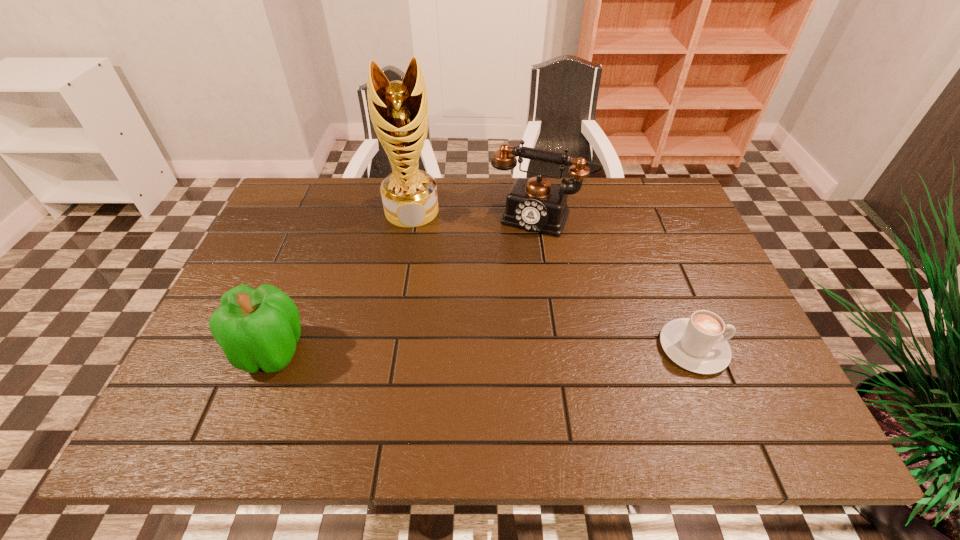
Find the location of a particular element. This screenshot has height=540, width=960. object that is positioned at the left edge is located at coordinates (257, 328).

Identify the location of object present at the right edge. (696, 344).

Where is `object positioned at the near left corner`? Image resolution: width=960 pixels, height=540 pixels. object positioned at the near left corner is located at coordinates (257, 328).

Find the location of a particular element. The width and height of the screenshot is (960, 540). object present at the near right corner is located at coordinates (696, 344).

Find the location of `vacant space at the far edge of the desktop`. vacant space at the far edge of the desktop is located at coordinates (378, 179).

Where is `free space at the near edge of the desktop`? This screenshot has width=960, height=540. free space at the near edge of the desktop is located at coordinates (634, 367).

Locate an element on the screen. free spot at the left edge of the desktop is located at coordinates (259, 261).

The width and height of the screenshot is (960, 540). In order to click on vacant position at the right edge of the desktop in this screenshot , I will do `click(667, 240)`.

The image size is (960, 540). Find the location of `vacant space at the far left corner of the desktop`. vacant space at the far left corner of the desktop is located at coordinates (315, 181).

Where is `free spot at the near left corner of the desktop`? The image size is (960, 540). free spot at the near left corner of the desktop is located at coordinates (251, 383).